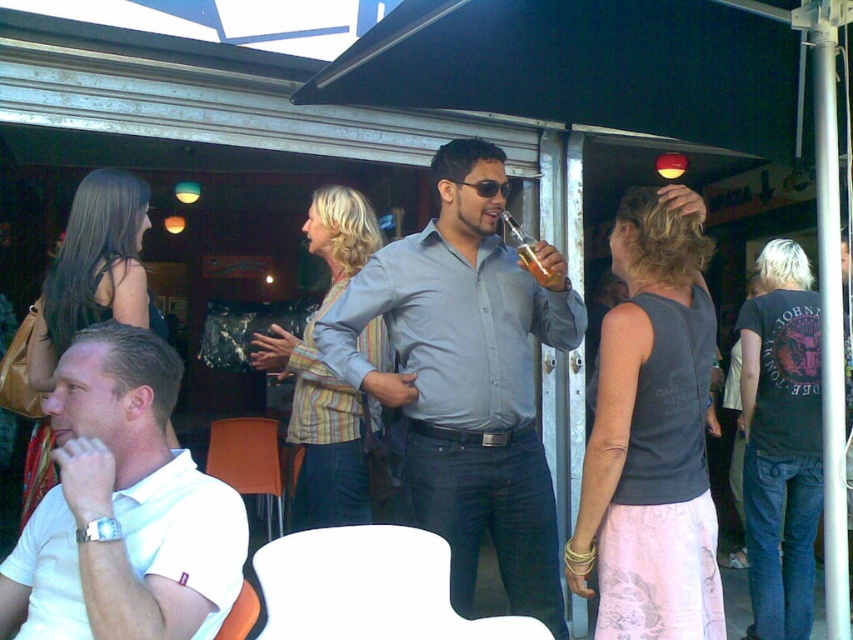
Can you confirm if striped fabric jacket at center is taller than matte black dress at left?

Correct, striped fabric jacket at center is much taller as matte black dress at left.

Which is in front, point (329, 196) or point (65, 257)?

Point (65, 257) is more forward.

Find the location of a particular element. This screenshot has width=853, height=640. striped fabric jacket at center is located at coordinates (328, 374).

Is white matte polo shirt at left smaller than striped fabric jacket at center?

Yes.

Is white matte polo shirt at left above striped fabric jacket at center?

No, white matte polo shirt at left is not above striped fabric jacket at center.

Image resolution: width=853 pixels, height=640 pixels. I want to click on white matte polo shirt at left, so click(123, 509).

Who is shorter, matte gray shirt at center or black cotton t-shirt at right?

matte gray shirt at center is shorter.

Image resolution: width=853 pixels, height=640 pixels. Find the location of `matte gray shirt at center`. matte gray shirt at center is located at coordinates (467, 378).

At what (x,y) coordinates should I click in order to perform the action: click on matte gray shirt at center. Please return your answer as a coordinate pair (x, y). The image size is (853, 640). Looking at the image, I should click on (467, 378).